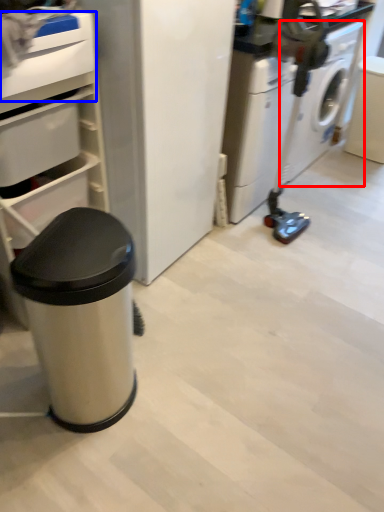
Question: Among these objects, which one is farthest to the camera, washing machine (highlighted by a red box) or drawer (highlighted by a blue box)?

Choices:
 (A) washing machine
 (B) drawer

Answer: (A)